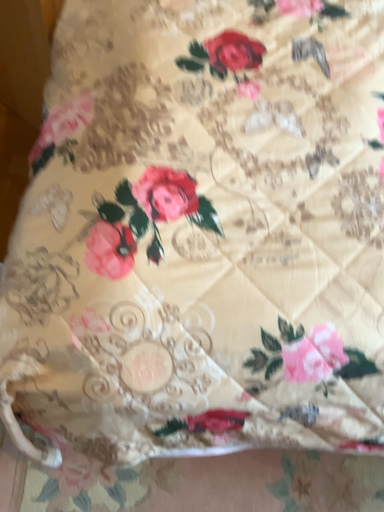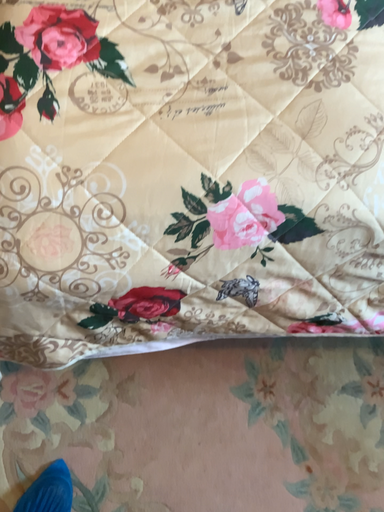
Question: Which way did the camera rotate in the video?

Choices:
 (A) rotated downward
 (B) rotated upward

Answer: (A)